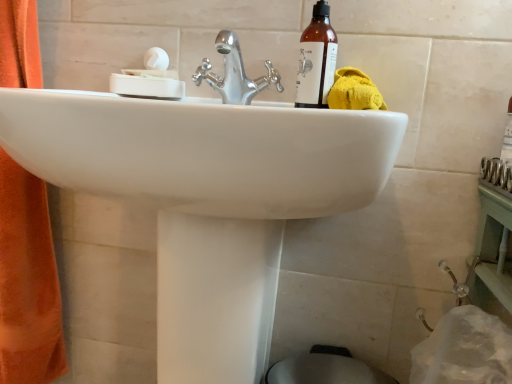
Question: In terms of size, does brown glass bottle at upper right appear bigger or smaller than chrome metallic faucet at center?

Choices:
 (A) small
 (B) big

Answer: (A)

Question: Is brown glass bottle at upper right in front of or behind chrome metallic faucet at center in the image?

Choices:
 (A) behind
 (B) front

Answer: (A)

Question: Estimate the real-world distances between objects in this image. Which object is closer to the chrome metallic faucet at center?

Choices:
 (A) brown glass bottle at upper right
 (B) white matte soap dish at upper left
 (C) white glossy sink at center
 (D) yellow fabric towel at upper right

Answer: (B)

Question: Estimate the real-world distances between objects in this image. Which object is closer to the brown glass bottle at upper right?

Choices:
 (A) white glossy sink at center
 (B) chrome metallic faucet at center
 (C) white matte soap dish at upper left
 (D) yellow fabric towel at upper right

Answer: (D)